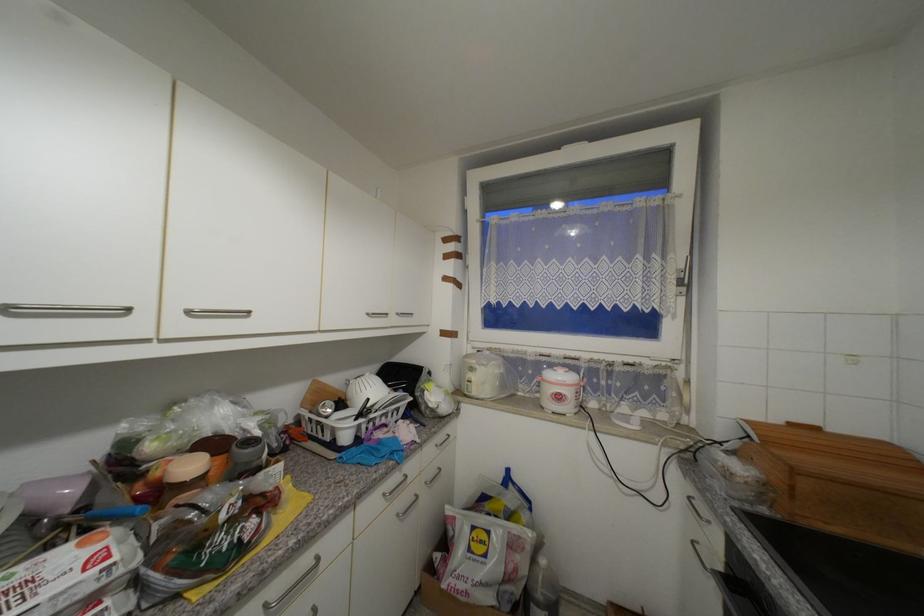
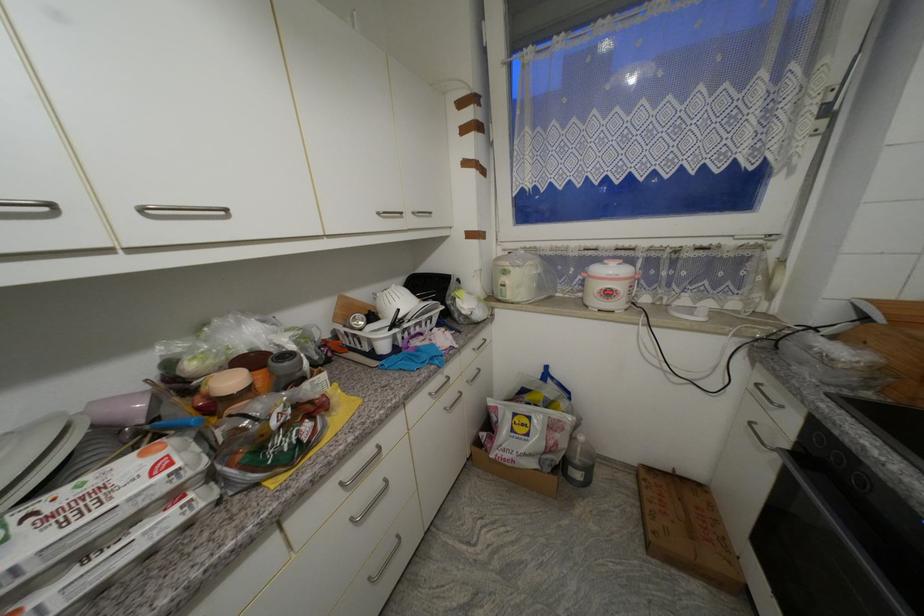
Where in the second image is the point corresponding to [403,315] from the first image?

(419, 215)